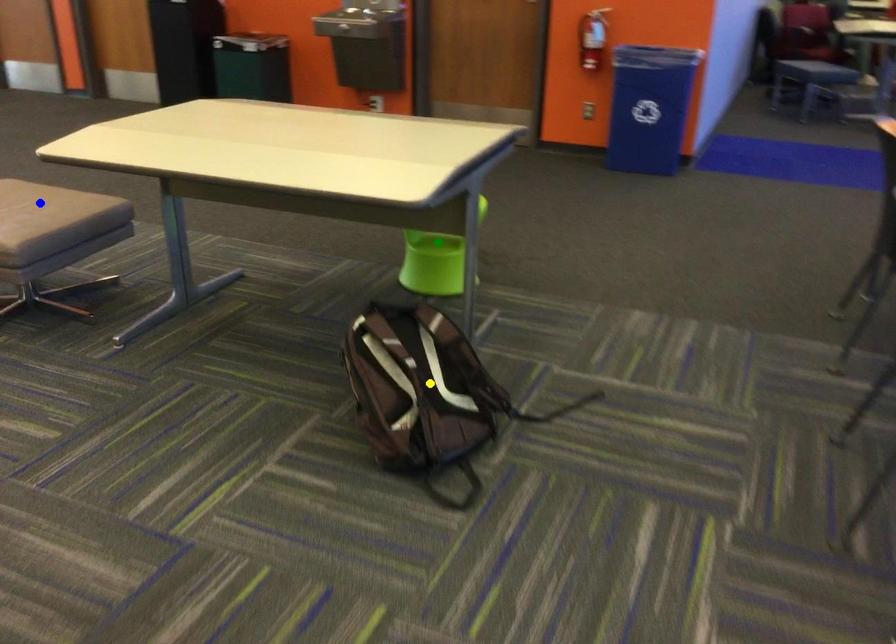
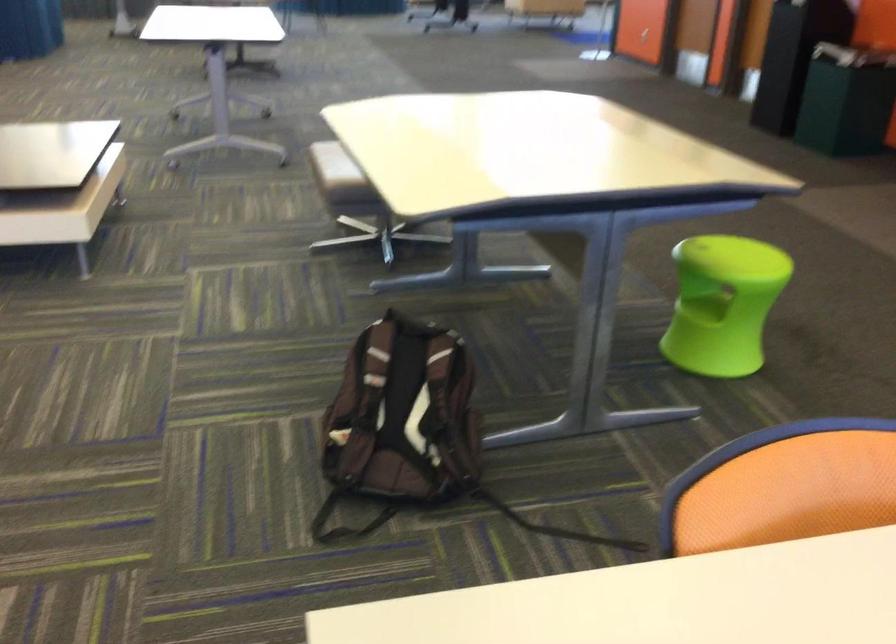
I am providing you with two images of the same scene from different viewpoints. Three points are marked in image1. Which point corresponds to a part or object that is occluded in image2?In image1, three points are marked. Which of them correspond to a part or object that is occluded in image2?Among the three points shown in image1, which one corresponds to a part or object that is no longer visible due to occlusion in image2?

Invisible in image2: blue point.